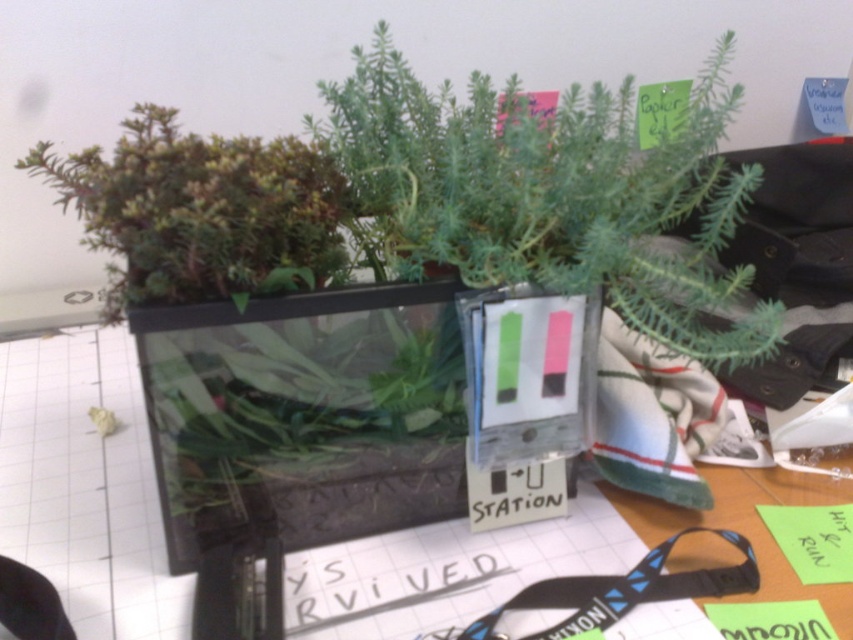
You are organizing a desk and see the green matte plant at center and the green matte plant at upper left in the terrarium. Which plant is positioned to the right of the other?

The green matte plant at center is positioned to the right of the green matte plant at upper left.

You are organizing a plant display and need to arrange the green matte plant at center and the green matte plant at upper left based on their sizes. Which one should be placed in the larger designated spot?

The green matte plant at center should be placed in the larger designated spot because it is larger in size than the green matte plant at upper left.

You are organizing a plant exhibition and need to arrange plants based on their width. You have a green matte plant at center and a green matte plant at upper left. Which plant should you place in the wider section of the exhibition layout?

The green matte plant at center should be placed in the wider section since it might be wider than the green matte plant at upper left.